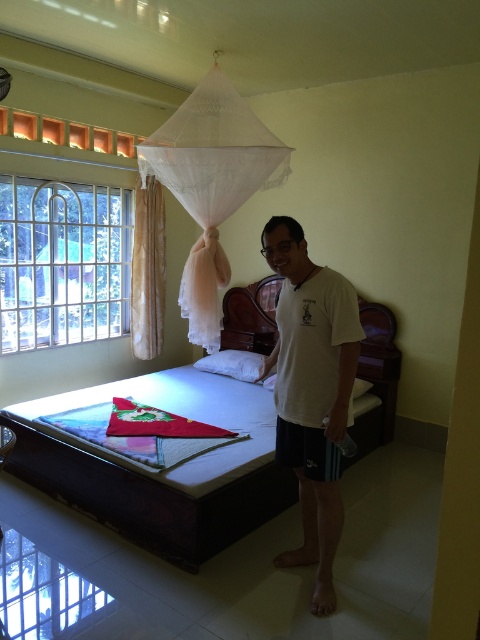
You are trying to decide whether to place a new painting on the clear glass window at left or the white soft pillow at center. Which surface can accommodate a wider painting?

The clear glass window at left has a larger width than the white soft pillow at center, so it can accommodate a wider painting.

Consider the image. You are standing in the bedroom and want to hang a small picture frame on the wall behind the bed. The frame requires a nail that must be placed exactly 5 meters away from your current position. Is the point at coordinates point (x=58, y=188) suitable for hanging the frame?

The distance between point (x=58, y=188) and the viewer is 4.96 meters, which is slightly less than the required 5 meters. Therefore, the point at coordinates point 0.295, 0.291 would not be suitable for hanging the frame as it is 0.04 meters too close.